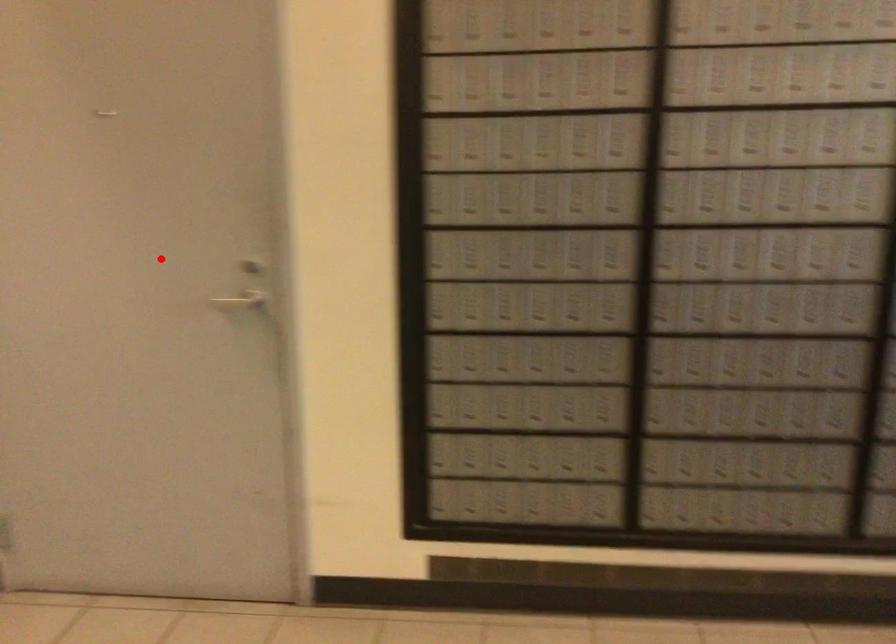
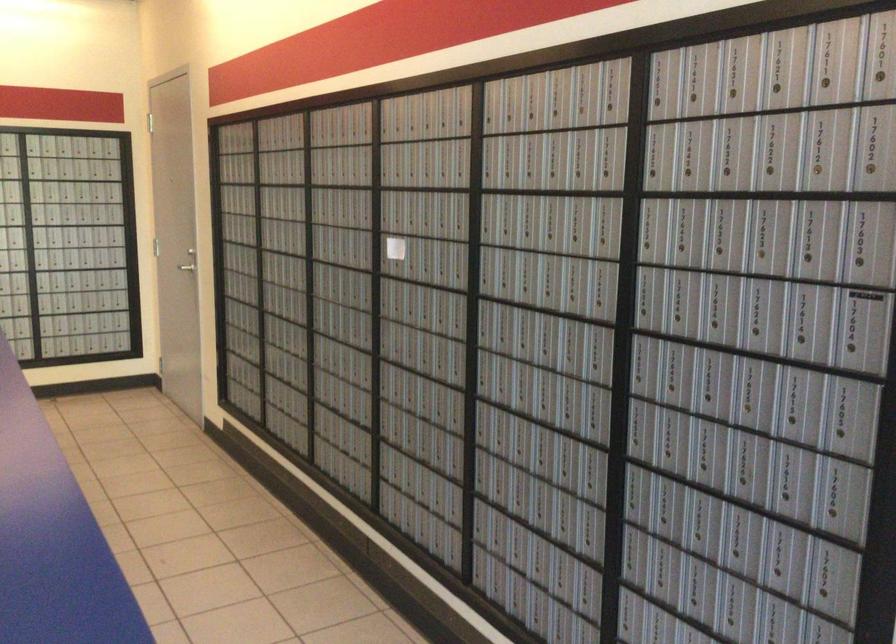
Question: I am providing you with two images of the same scene from different viewpoints. A red point is shown in image1. For the corresponding object point in image2, is it positioned nearer or farther from the camera?

Choices:
 (A) Nearer
 (B) Farther

Answer: (B)